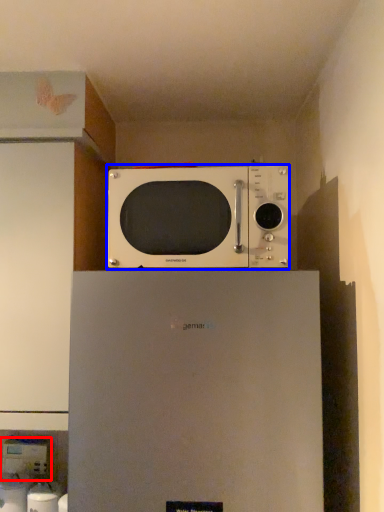
Question: Which point is further to the camera, appliance (highlighted by a red box) or microwave oven (highlighted by a blue box)?

Choices:
 (A) appliance
 (B) microwave oven

Answer: (A)